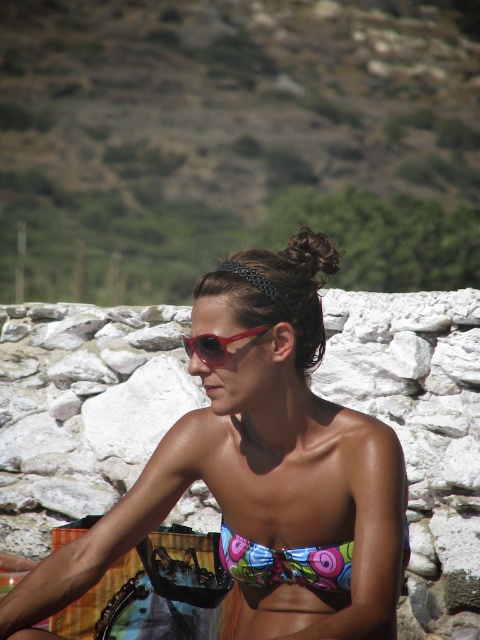
Question: Which point is closer to the camera taking this photo?

Choices:
 (A) (337, 460)
 (B) (228, 548)

Answer: (A)

Question: Which is nearer to the matte pink sunglasses at center?

Choices:
 (A) multicolored fabric bikini at center
 (B) shiny red sunglasses at center

Answer: (A)

Question: Can you confirm if matte pink sunglasses at center is positioned below multicolored fabric bikini at center?

Choices:
 (A) yes
 (B) no

Answer: (B)

Question: Which of the following is the farthest from the observer?

Choices:
 (A) (296, 364)
 (B) (194, 342)

Answer: (A)

Question: Can you confirm if matte pink sunglasses at center is positioned above shiny red sunglasses at center?

Choices:
 (A) yes
 (B) no

Answer: (B)

Question: Does matte pink sunglasses at center lie behind multicolored fabric bikini at center?

Choices:
 (A) yes
 (B) no

Answer: (B)